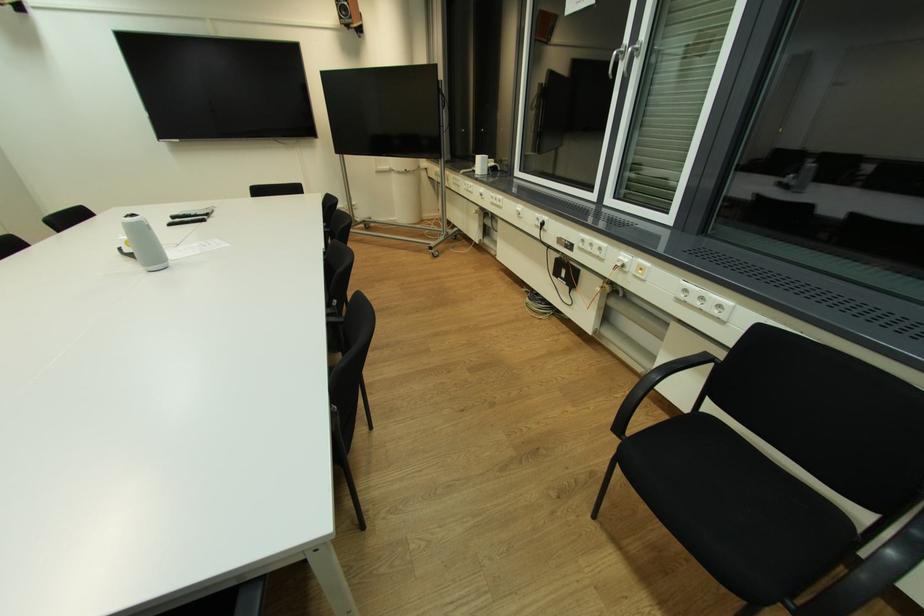
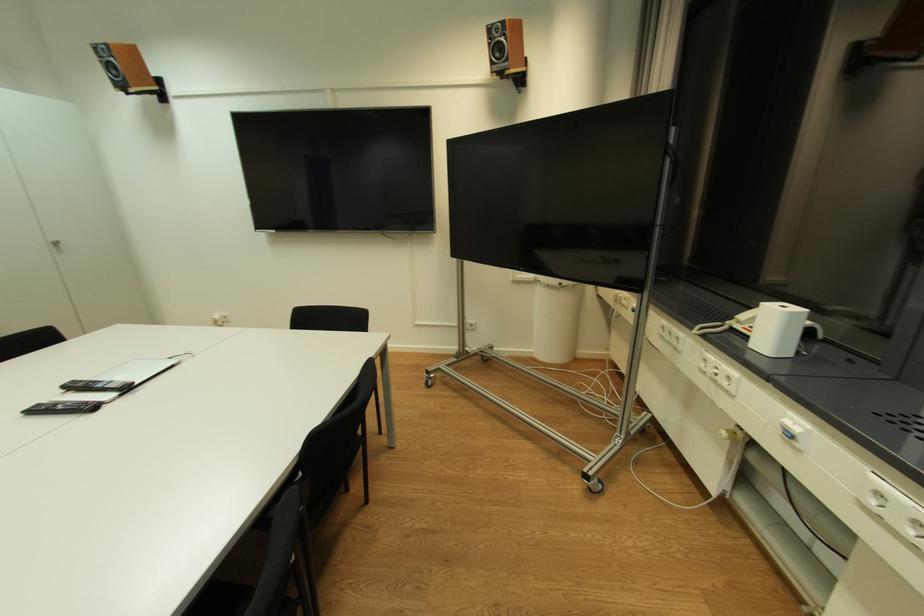
Locate, in the second image, the point that corresponds to [398,177] in the first image.

(544, 290)